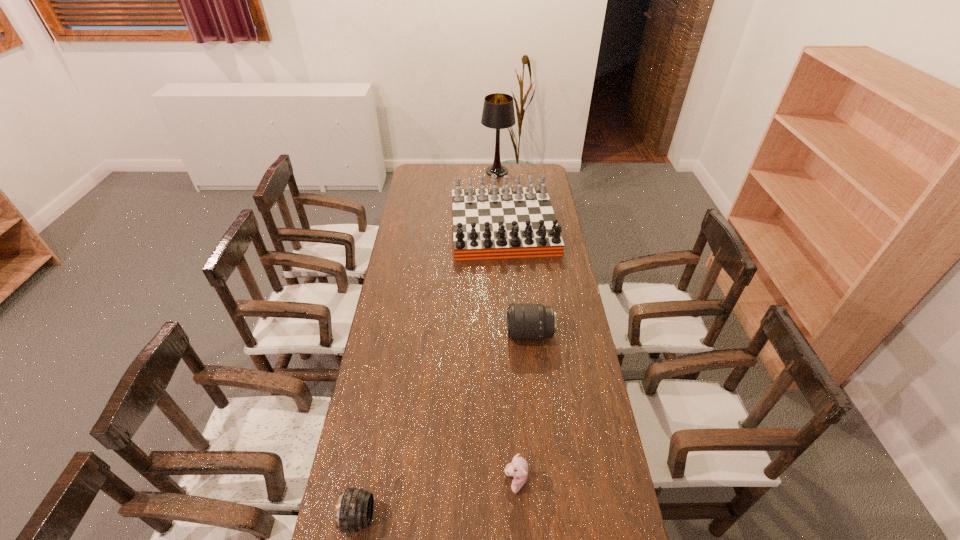
Locate an element on the screen. Image resolution: width=960 pixels, height=540 pixels. vacant area that lies between the fourth nearest object and the third shortest object is located at coordinates (516, 280).

Locate an element on the screen. free point between the shorter telephoto lens and the taller telephoto lens is located at coordinates (444, 426).

What are the coordinates of `vacant area between the right telephoto lens and the left telephoto lens` in the screenshot? It's located at (444, 426).

The image size is (960, 540). Find the location of `free space between the second nearest object and the third nearest object`. free space between the second nearest object and the third nearest object is located at coordinates (523, 408).

Where is `empty space that is in between the nearer telephoto lens and the third nearest object`? The image size is (960, 540). empty space that is in between the nearer telephoto lens and the third nearest object is located at coordinates (444, 426).

Identify the location of empty space that is in between the third farthest object and the leftmost object. (444, 426).

Choose which object is the nearest neighbor to the tallest object. Please provide its 2D coordinates. Your answer should be formatted as a tuple, i.e. [(x, y)], where the tuple contains the x and y coordinates of a point satisfying the conditions above.

[(505, 222)]

You are a GUI agent. You are given a task and a screenshot of the screen. Output one action in this format:
    pyautogui.click(x=<x>, y=<y>)
    Task: Click on the object that can be found as the fourth closest to the nearest object
    
    Given the screenshot: What is the action you would take?
    pyautogui.click(x=498, y=113)

Locate an element on the screen. free spot that satisfies the following two spatial constraints: 1. on the front side of the tallest object; 2. at the front element of the nearest object is located at coordinates (516, 517).

The width and height of the screenshot is (960, 540). I want to click on vacant space that satisfies the following two spatial constraints: 1. on the front side of the fourth nearest object; 2. at the front element of the shorter telephoto lens, so click(522, 517).